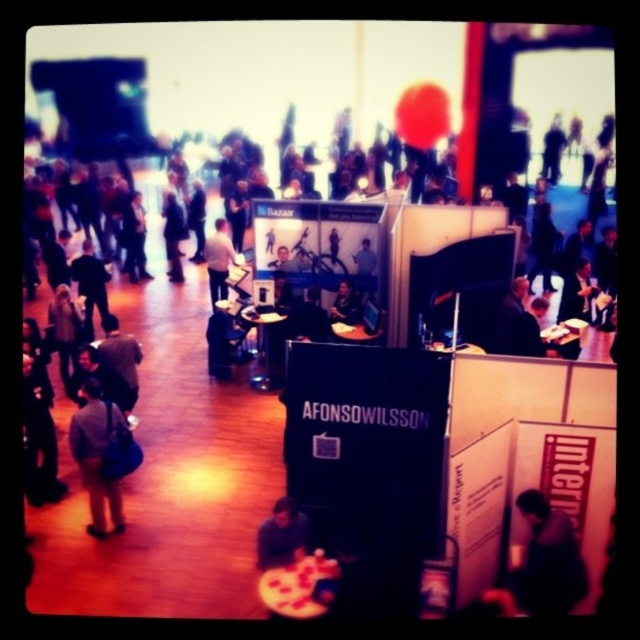
Question: Which of the following is the closest to the observer?

Choices:
 (A) (216, 269)
 (B) (566, 582)
 (C) (257, 552)

Answer: (B)

Question: In this image, where is gray fabric jacket at left located relative to white fabric shirt at center?

Choices:
 (A) left
 (B) right

Answer: (A)

Question: Considering the relative positions of gray fabric jacket at left and white fabric shirt at center in the image provided, where is gray fabric jacket at left located with respect to white fabric shirt at center?

Choices:
 (A) below
 (B) above

Answer: (A)

Question: Which point is farther to the camera?

Choices:
 (A) (225, 273)
 (B) (289, 497)

Answer: (A)

Question: Is dark brown hair at lower center bigger than white fabric shirt at center?

Choices:
 (A) yes
 (B) no

Answer: (B)

Question: Which is nearer to the white fabric shirt at center?

Choices:
 (A) dark brown hair at lower center
 (B) gray fabric jacket at left
 (C) dark gray fabric shirt at lower right

Answer: (B)